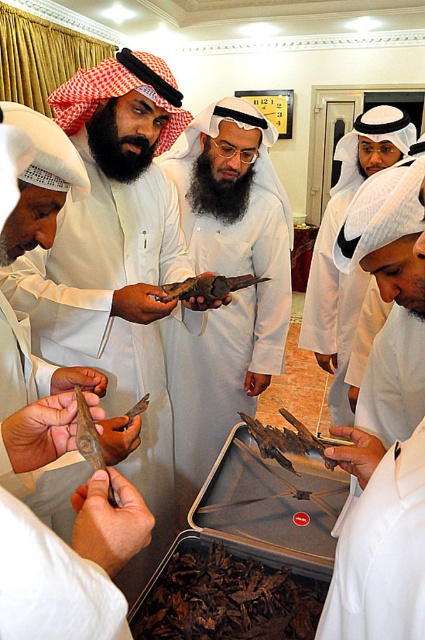
Question: Is brown dried leaves at center thinner than white matte headscarf at center?

Choices:
 (A) no
 (B) yes

Answer: (B)

Question: Among these objects, which one is farthest from the camera?

Choices:
 (A) white matte robe at center
 (B) brown wooden stick at center
 (C) white matte phone at center

Answer: (B)

Question: Is matte brown wooden sword at center to the left of white matte headscarf at center from the viewer's perspective?

Choices:
 (A) no
 (B) yes

Answer: (B)

Question: Among these objects, which one is farthest from the camera?

Choices:
 (A) white matte phone at center
 (B) matte brown wooden sword at center
 (C) white matte robe at center

Answer: (B)

Question: Does matte brown wooden sword at center have a lesser width compared to white matte/soft robe at lower left?

Choices:
 (A) no
 (B) yes

Answer: (A)

Question: Which object appears closest to the camera in this image?

Choices:
 (A) matte brown wooden sword at center
 (B) brown leather object at center
 (C) brown wooden stick at center
 (D) brown dried leaves at center

Answer: (D)